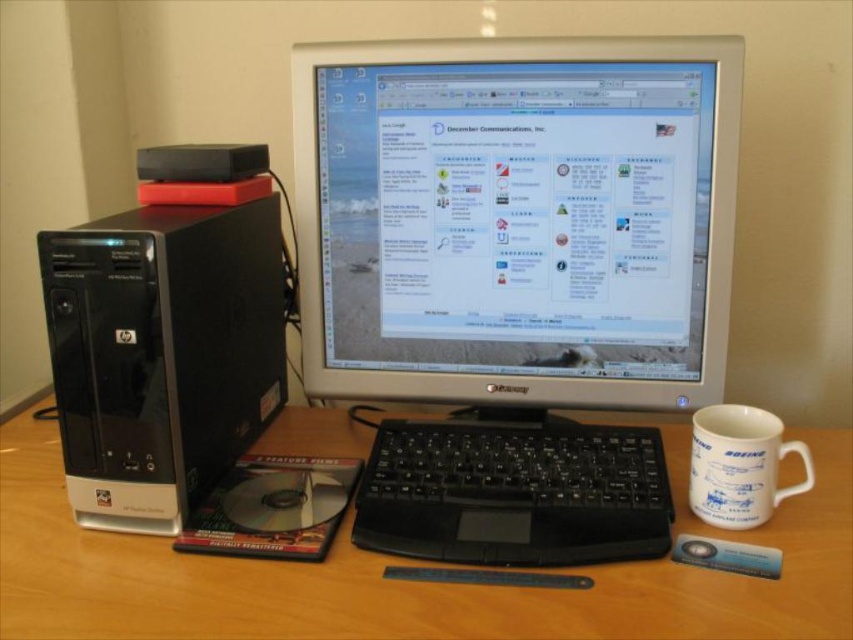
Question: Does wooden desk at center have a lesser width compared to black plastic keyboard at center?

Choices:
 (A) no
 (B) yes

Answer: (A)

Question: Estimate the real-world distances between objects in this image. Which object is closer to the black plastic keyboard at center?

Choices:
 (A) white ceramic mug at right
 (B) silver plastic monitor at center
 (C) wooden desk at center
 (D) black plastic desktop at left

Answer: (C)

Question: Where is wooden desk at center located in relation to black plastic desktop at left in the image?

Choices:
 (A) left
 (B) right

Answer: (B)

Question: Which point is closer to the camera?

Choices:
 (A) black plastic keyboard at center
 (B) white ceramic mug at right

Answer: (A)

Question: Which of the following is the closest to the observer?

Choices:
 (A) (556, 500)
 (B) (260, 396)

Answer: (A)

Question: Considering the relative positions of wooden desk at center and black plastic keyboard at center in the image provided, where is wooden desk at center located with respect to black plastic keyboard at center?

Choices:
 (A) below
 (B) above

Answer: (A)